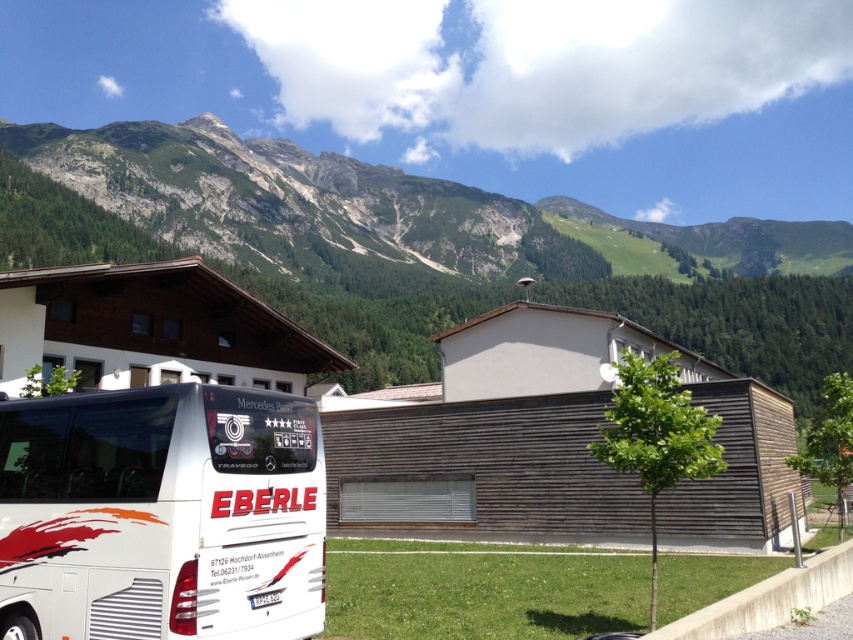
Who is lower down, green rocky mountain at upper center or white matte bus at lower left?

white matte bus at lower left is lower down.

Which is more to the right, green rocky mountain at upper center or white matte bus at lower left?

From the viewer's perspective, green rocky mountain at upper center appears more on the right side.

I want to click on green rocky mountain at upper center, so click(392, 250).